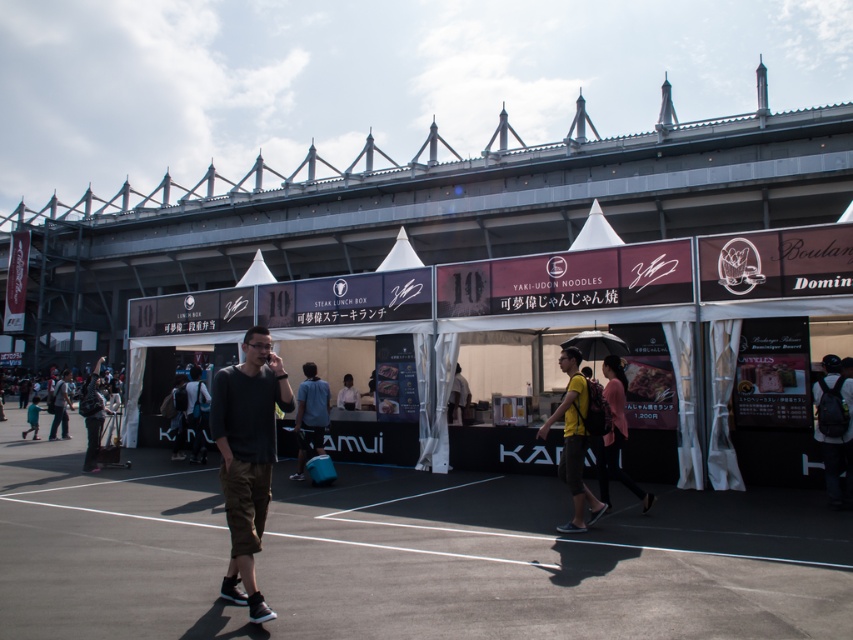
From the picture: Can you confirm if black backpack at lower right is smaller than pink fabric shirt at center?

Indeed, black backpack at lower right has a smaller size compared to pink fabric shirt at center.

Which is in front, point (838, 362) or point (628, 477)?

Point (628, 477) is more forward.

Between point (837, 470) and point (607, 500), which one is positioned in front?

Point (607, 500) is more forward.

This screenshot has height=640, width=853. What are the coordinates of `black backpack at lower right` in the screenshot? It's located at 834,429.

Can you confirm if yellow fabric shirt at center is positioned to the left of white matte shirt at center?

Incorrect, yellow fabric shirt at center is not on the left side of white matte shirt at center.

Is the position of yellow fabric shirt at center more distant than that of white matte shirt at center?

No, yellow fabric shirt at center is closer to the viewer.

This screenshot has width=853, height=640. What do you see at coordinates (573, 442) in the screenshot?
I see `yellow fabric shirt at center` at bounding box center [573, 442].

Locate an element on the screen. The width and height of the screenshot is (853, 640). yellow fabric shirt at center is located at coordinates (573, 442).

Does black backpack at lower right have a larger size compared to white matte shirt at center?

Correct, black backpack at lower right is larger in size than white matte shirt at center.

Is point (831, 458) closer to viewer compared to point (345, 396)?

Yes, point (831, 458) is closer to viewer.

Image resolution: width=853 pixels, height=640 pixels. What are the coordinates of `black backpack at lower right` in the screenshot? It's located at (834, 429).